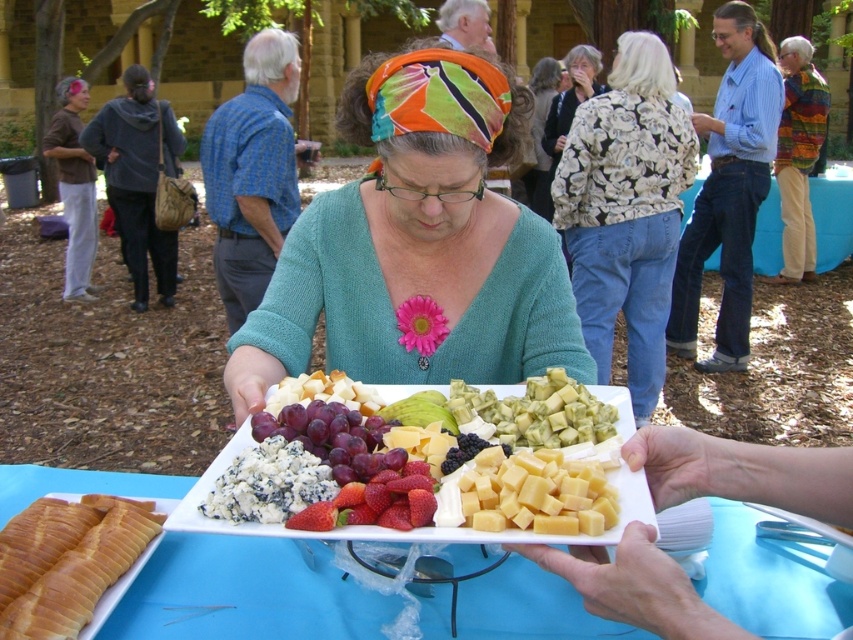
Question: Can you confirm if floral-patterned jacket at center is thinner than blue crumbly cheese at center?

Choices:
 (A) no
 (B) yes

Answer: (A)

Question: Which object is positioned closest to the white plastic tray at center?

Choices:
 (A) teal knitted sweater at center
 (B) blue crumbly cheese at center
 (C) ripe red strawberries at center
 (D) floral-patterned jacket at center

Answer: (B)

Question: Does floral-patterned jacket at center appear on the right side of blue crumbly cheese at center?

Choices:
 (A) yes
 (B) no

Answer: (A)

Question: Does floral-patterned jacket at center appear over yellow hard cheese at center?

Choices:
 (A) no
 (B) yes

Answer: (B)

Question: Considering the real-world distances, which object is closest to the floral-patterned jacket at center?

Choices:
 (A) teal knitted sweater at center
 (B) yellow hard cheese at center

Answer: (A)

Question: Which point appears closest to the camera in this image?

Choices:
 (A) (425, 492)
 (B) (408, 540)
 (C) (674, 141)
 (D) (469, 508)

Answer: (B)